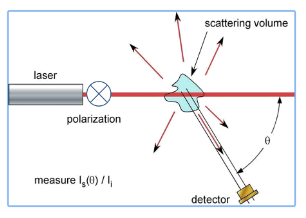
You are a GUI agent. You are given a task and a screenshot of the screen. Output one action in this format:
    pyautogui.click(x=<x>, y=<y>)
    Task: Click on the plug
    The image size is (306, 218).
    Given the screenshot: What is the action you would take?
    pyautogui.click(x=252, y=199)